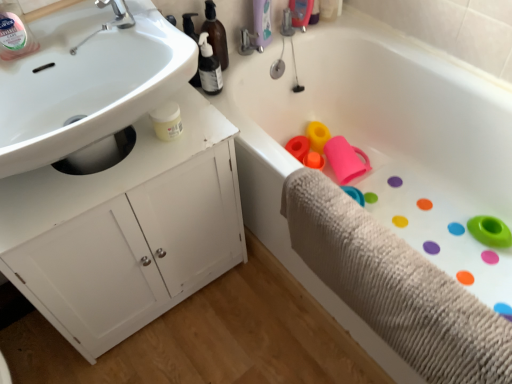
Question: Can white matte cabinet at left be found inside silver metallic faucet at upper left?

Choices:
 (A) no
 (B) yes

Answer: (A)

Question: Is silver metallic faucet at upper left thinner than white matte cabinet at left?

Choices:
 (A) no
 (B) yes

Answer: (B)

Question: Is silver metallic faucet at upper left beside white matte cabinet at left?

Choices:
 (A) yes
 (B) no

Answer: (B)

Question: Can you confirm if silver metallic faucet at upper left is taller than white matte cabinet at left?

Choices:
 (A) no
 (B) yes

Answer: (A)

Question: Considering the relative positions of silver metallic faucet at upper left and white matte cabinet at left in the image provided, is silver metallic faucet at upper left behind white matte cabinet at left?

Choices:
 (A) yes
 (B) no

Answer: (A)

Question: Is silver metallic faucet at upper left at the right side of white matte cabinet at left?

Choices:
 (A) no
 (B) yes

Answer: (B)

Question: Is white matte cabinet at left surrounding clear plastic bottle at upper left?

Choices:
 (A) no
 (B) yes

Answer: (A)

Question: Is white matte cabinet at left looking in the opposite direction of clear plastic bottle at upper left?

Choices:
 (A) yes
 (B) no

Answer: (B)

Question: From a real-world perspective, is white matte cabinet at left located higher than clear plastic bottle at upper left?

Choices:
 (A) yes
 (B) no

Answer: (B)

Question: From a real-world perspective, does white matte cabinet at left sit lower than clear plastic bottle at upper left?

Choices:
 (A) yes
 (B) no

Answer: (A)

Question: Is white matte cabinet at left further to the viewer compared to clear plastic bottle at upper left?

Choices:
 (A) no
 (B) yes

Answer: (A)

Question: Considering the relative positions of white matte cabinet at left and clear plastic bottle at upper left in the image provided, is white matte cabinet at left to the right of clear plastic bottle at upper left from the viewer's perspective?

Choices:
 (A) no
 (B) yes

Answer: (B)

Question: From a real-world perspective, is clear plastic bottle at upper left located beneath white matte cabinet at left?

Choices:
 (A) yes
 (B) no

Answer: (B)